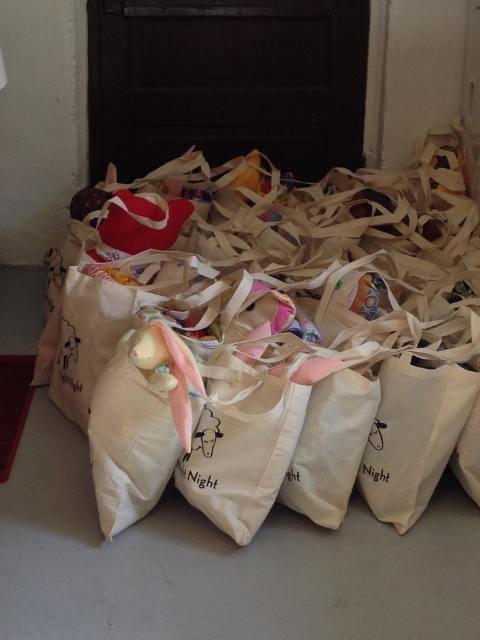
Who is higher up, white cotton bag at center or soft pink fabric stuffed animal at center?

Positioned higher is white cotton bag at center.

Between white cotton bag at center and soft pink fabric stuffed animal at center, which one appears on the left side from the viewer's perspective?

Positioned to the left is soft pink fabric stuffed animal at center.

This screenshot has height=640, width=480. What do you see at coordinates (288, 344) in the screenshot?
I see `white cotton bag at center` at bounding box center [288, 344].

The image size is (480, 640). In order to click on white cotton bag at center in this screenshot , I will do `click(288, 344)`.